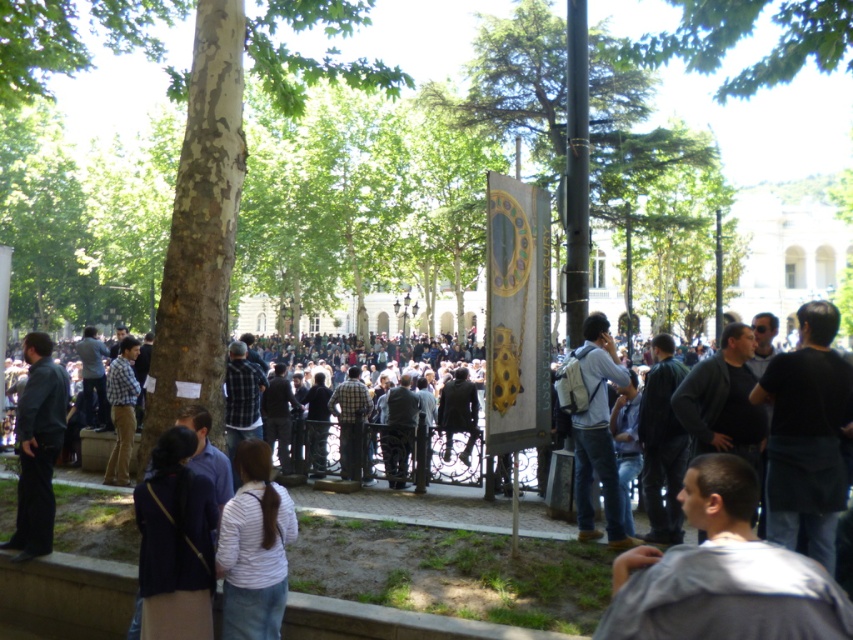
Question: Does gray fabric jacket at lower right have a smaller size compared to black fabric shirt at right?

Choices:
 (A) yes
 (B) no

Answer: (A)

Question: Which object appears farthest from the camera in this image?

Choices:
 (A) dark purple sweater at lower left
 (B) dark blue shirt at left
 (C) green leafy tree at upper center

Answer: (C)

Question: From the image, what is the correct spatial relationship of gray fabric jacket at lower right in relation to dark purple sweater at lower left?

Choices:
 (A) right
 (B) left

Answer: (A)

Question: Does black fabric shirt at right appear under dark blue shirt at left?

Choices:
 (A) yes
 (B) no

Answer: (B)

Question: Which of the following is the closest to the observer?

Choices:
 (A) 117,410
 (B) 753,4
 (C) 265,625

Answer: (C)

Question: Which point is closer to the camera?

Choices:
 (A) white striped shirt at center
 (B) black fabric shirt at right
 (C) green leafy tree at upper center

Answer: (A)